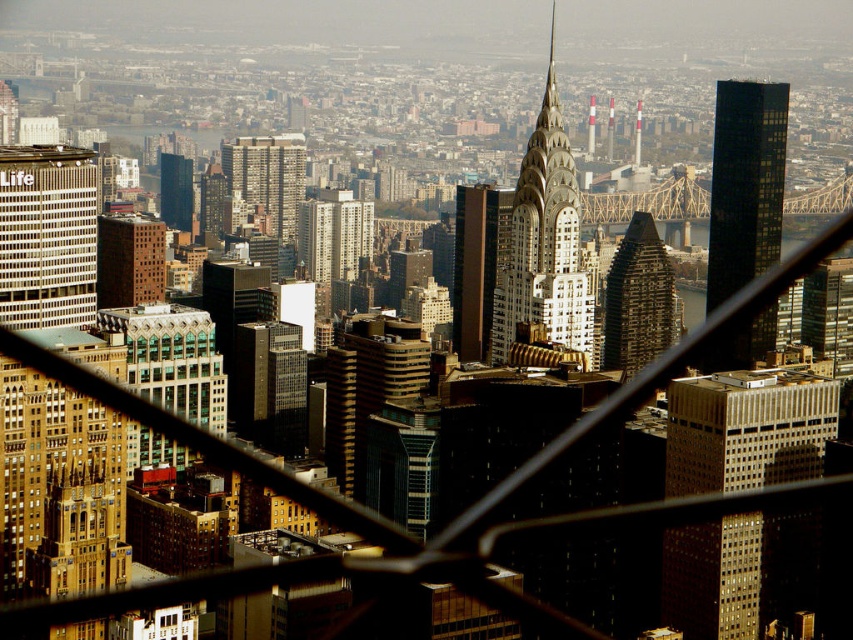
You are a drone operator tasked with flying a drone between the black glass skyscraper at right and the smooth white spire at center. The drone has a maximum flight distance of 150 feet. Can the drone safely navigate between these two structures without exceeding its range?

The black glass skyscraper at right and smooth white spire at center are 133.94 feet apart from each other. Since the drone has a maximum flight distance of 150 feet, it can safely navigate between them as the distance is within its range.